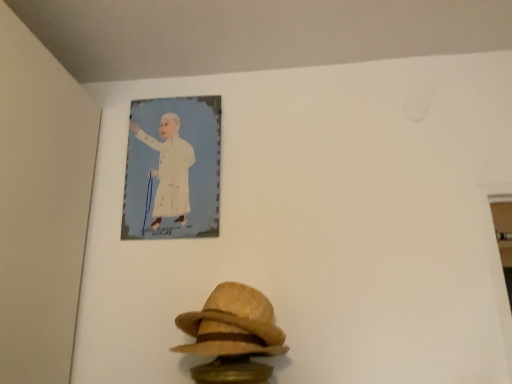
Question: From the image's perspective, is felt straw fedora at lower center positioned above or below white paper portrait at upper center?

Choices:
 (A) below
 (B) above

Answer: (A)

Question: From a real-world perspective, is felt straw fedora at lower center physically located above or below white paper portrait at upper center?

Choices:
 (A) below
 (B) above

Answer: (A)

Question: Considering the positions of felt straw fedora at lower center and white paper portrait at upper center in the image, is felt straw fedora at lower center wider or thinner than white paper portrait at upper center?

Choices:
 (A) wide
 (B) thin

Answer: (A)

Question: In terms of height, does white paper portrait at upper center look taller or shorter compared to felt straw fedora at lower center?

Choices:
 (A) short
 (B) tall

Answer: (B)

Question: Is white paper portrait at upper center in front of or behind felt straw fedora at lower center in the image?

Choices:
 (A) front
 (B) behind

Answer: (B)

Question: From a real-world perspective, is white paper portrait at upper center physically located above or below felt straw fedora at lower center?

Choices:
 (A) above
 (B) below

Answer: (A)

Question: Is white paper portrait at upper center situated inside felt straw fedora at lower center or outside?

Choices:
 (A) inside
 (B) outside

Answer: (B)